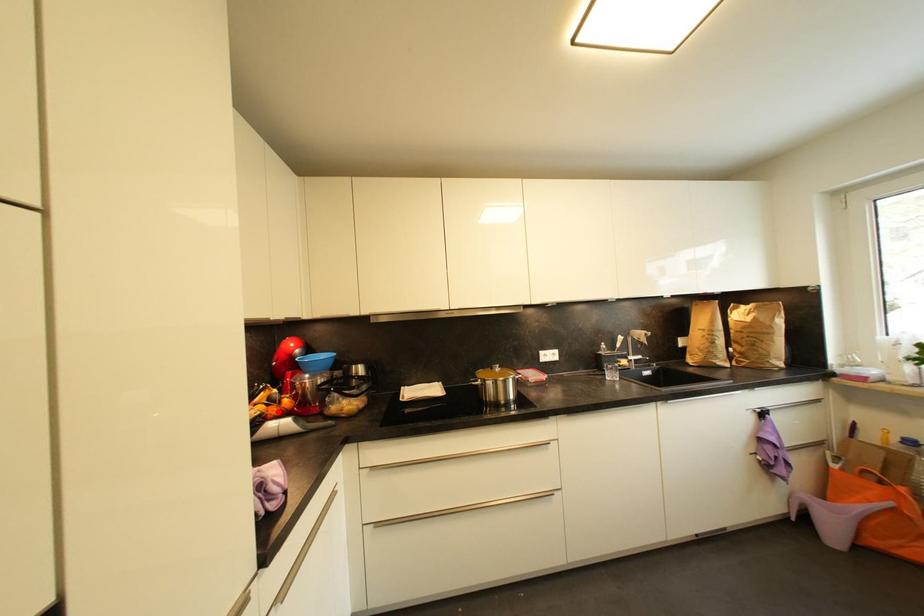
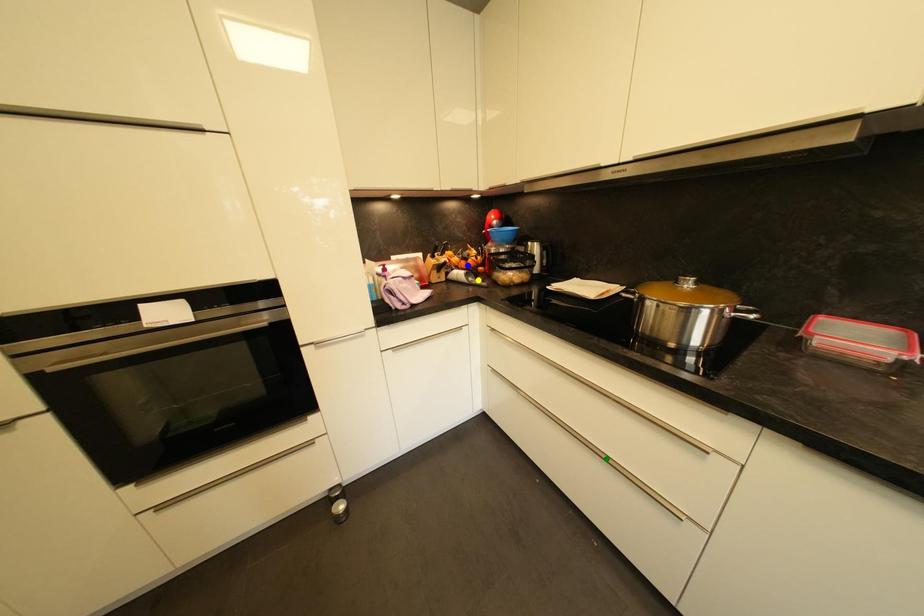
Question: I am providing you with two images of the same scene from different viewpoints. A red point is marked on the first image. You are given multiple points on the second image. Which spot in image 2 lines up with the point in image 1?

Choices:
 (A) green point
 (B) blue point
 (C) yellow point

Answer: (B)